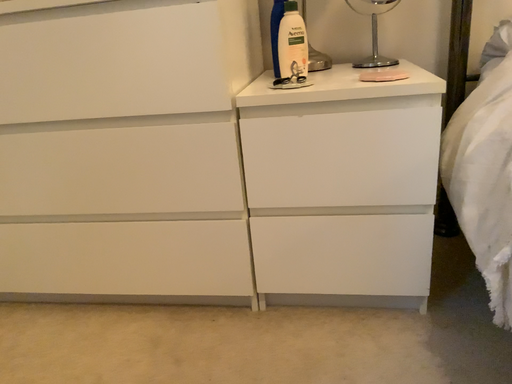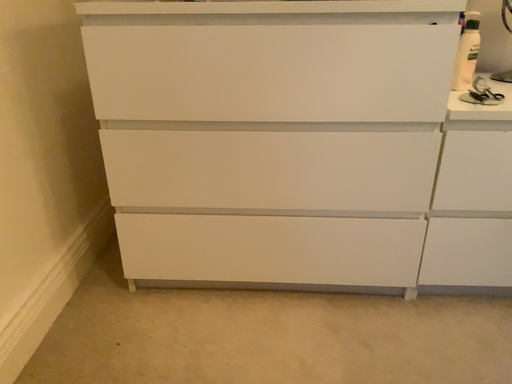
Question: How did the camera likely rotate when shooting the video?

Choices:
 (A) rotated left
 (B) rotated right

Answer: (B)